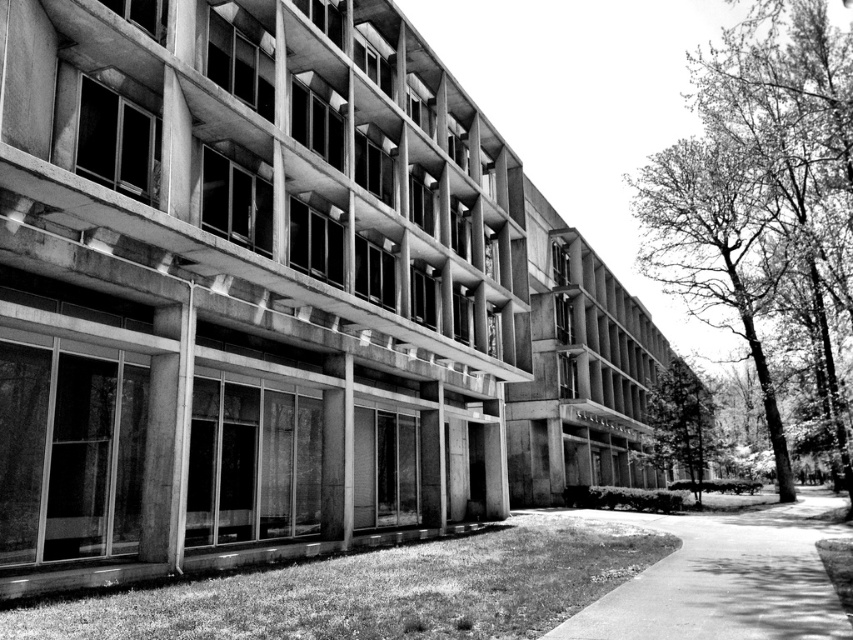
Question: Which point appears farthest from the camera in this image?

Choices:
 (A) (650, 588)
 (B) (701, 464)

Answer: (B)

Question: Is smooth concrete path at center to the left of green leafy tree at center from the viewer's perspective?

Choices:
 (A) no
 (B) yes

Answer: (B)

Question: Among these points, which one is farthest from the camera?

Choices:
 (A) (770, 157)
 (B) (657, 404)

Answer: (B)

Question: Which point appears farthest from the camera in this image?

Choices:
 (A) (730, 179)
 (B) (761, 554)
 (C) (708, 458)

Answer: (C)

Question: Can you confirm if smooth bark tree at right is positioned to the right of green leafy tree at center?

Choices:
 (A) no
 (B) yes

Answer: (B)

Question: Considering the relative positions of smooth bark tree at right and green leafy tree at center in the image provided, where is smooth bark tree at right located with respect to green leafy tree at center?

Choices:
 (A) above
 (B) below

Answer: (A)